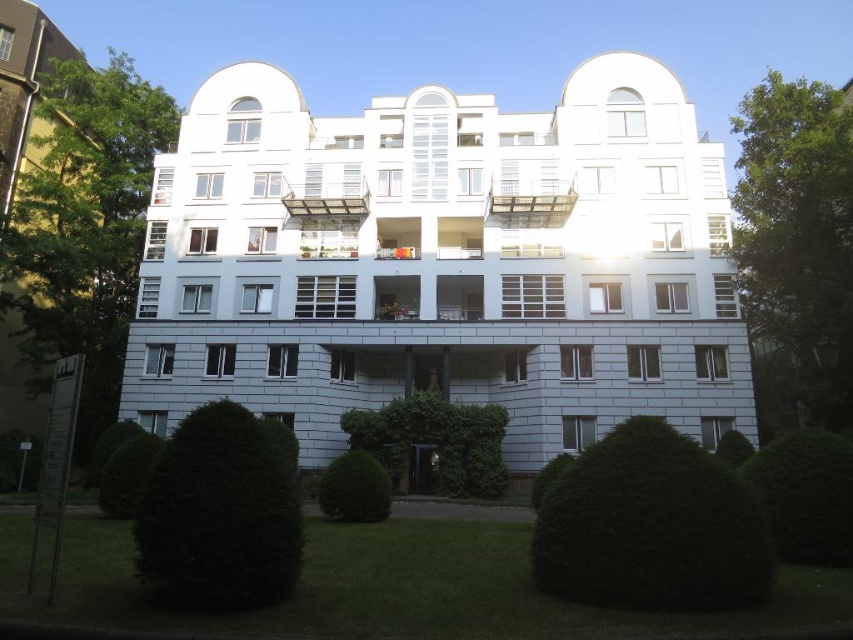
You are standing at the entrance of the residential building and see two points marked in the image. The first point is at coordinates point [815,145] and the second is at point [407,472]. Which point appears closer to you?

Point [407,472] is closer to you because it is less further to the camera than point [815,145].

You are a window cleaner standing at the entrance of the building. You need to clean the windows of the green leafy tree at left and the dark green leafy bush at lower center. Which one will require a ladder to reach?

The green leafy tree at left is much taller than the dark green leafy bush at lower center, so you will need a ladder to reach the green leafy tree at left.

You are standing at the entrance of the building and want to see the green leafy tree at left. Is the dark green leafy bush at lower center blocking your view of the tree?

The dark green leafy bush at lower center is behind the green leafy tree at left, so it does not block your view of the tree.